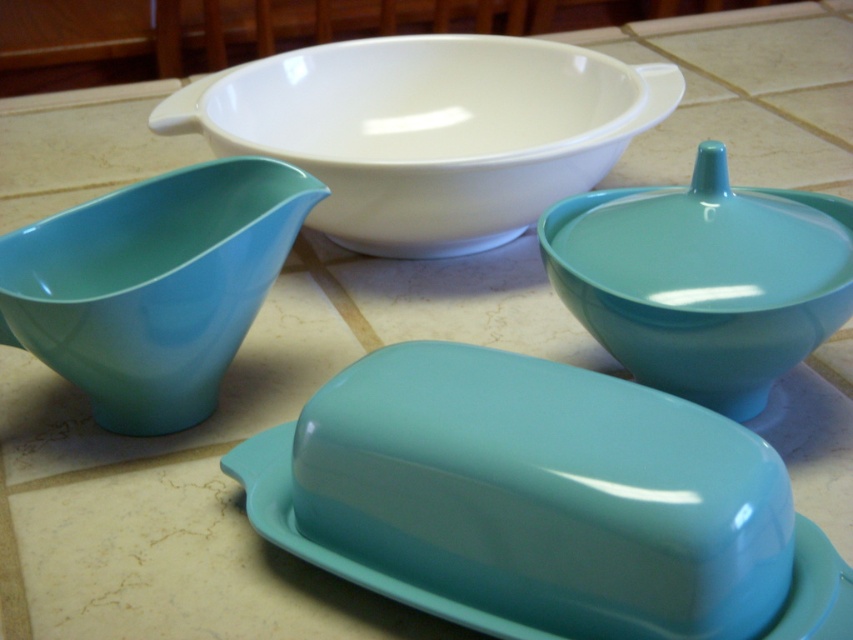
Can you confirm if white glossy bowl at upper center is wider than mint glossy mixing bowl at left?

Correct, the width of white glossy bowl at upper center exceeds that of mint glossy mixing bowl at left.

Does point (454, 115) lie in front of point (178, 252)?

No, it is not.

The width and height of the screenshot is (853, 640). Identify the location of white glossy bowl at upper center. (428, 131).

Consider the image. Is white glossy bowl at upper center further to the viewer compared to matte turquoise bowl at upper right?

Yes, white glossy bowl at upper center is further from the viewer.

Between point (531, 125) and point (782, 300), which one is positioned in front?

Point (782, 300)

I want to click on white glossy bowl at upper center, so click(x=428, y=131).

Who is shorter, mint glossy mixing bowl at left or matte turquoise bowl at upper right?

With less height is matte turquoise bowl at upper right.

Who is more distant from viewer, (x=154, y=392) or (x=672, y=280)?

The point (x=154, y=392) is behind.

Which is behind, point (257, 189) or point (694, 188)?

The point (257, 189) is more distant.

Find the location of a particular element. mint glossy mixing bowl at left is located at coordinates point(154,285).